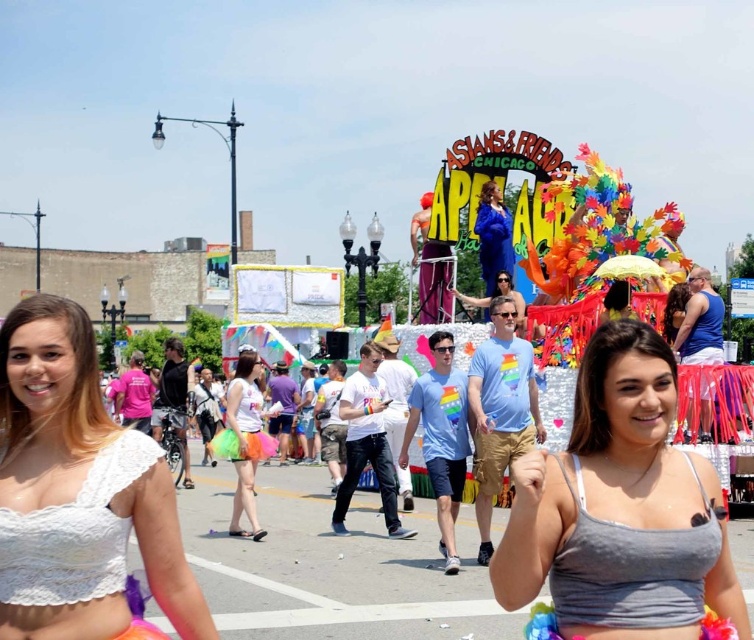
Question: Can you confirm if white lace bikini top at lower left is thinner than rainbow tulle skirt at center?

Choices:
 (A) yes
 (B) no

Answer: (B)

Question: Does gray fabric top at center have a greater width compared to rainbow tulle skirt at center?

Choices:
 (A) no
 (B) yes

Answer: (B)

Question: Which point is farther from the camera taking this photo?

Choices:
 (A) click(x=106, y=429)
 (B) click(x=489, y=216)

Answer: (B)

Question: Which point is farther to the camera?

Choices:
 (A) gray fabric top at center
 (B) rainbow tulle skirt at center

Answer: (B)

Question: Is white lace bikini top at lower left smaller than matte blue dress at center?

Choices:
 (A) yes
 (B) no

Answer: (B)

Question: Which object appears farthest from the camera in this image?

Choices:
 (A) white lace bikini top at lower left
 (B) gray fabric top at center
 (C) rainbow tulle skirt at center
 (D) matte blue dress at center

Answer: (D)